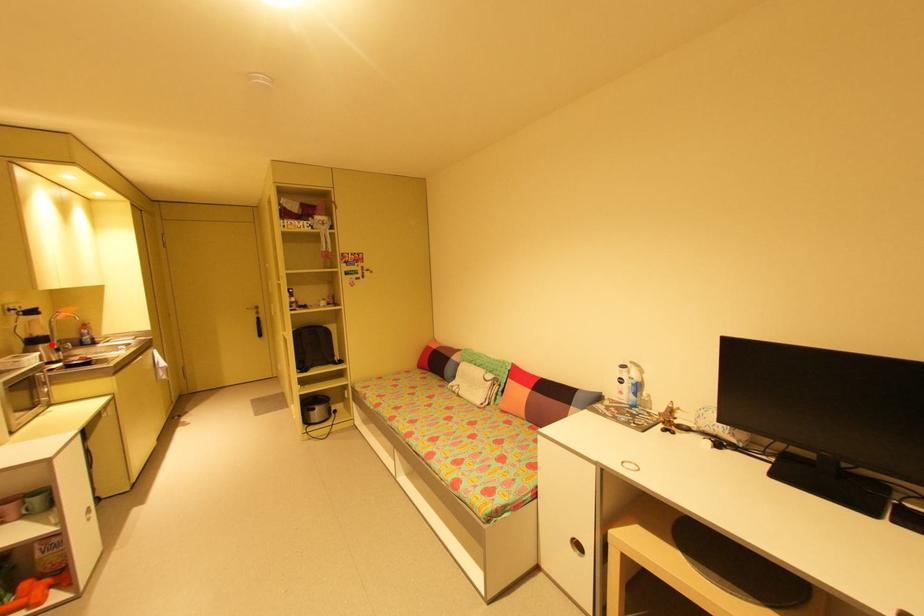
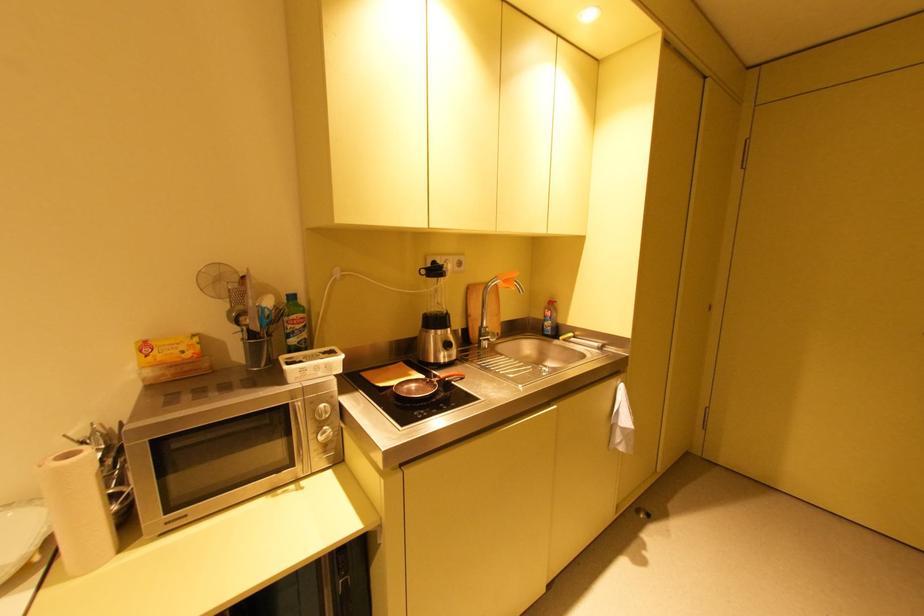
Locate, in the second image, the point that corresponds to the highlighted location in the first image.

(444, 331)